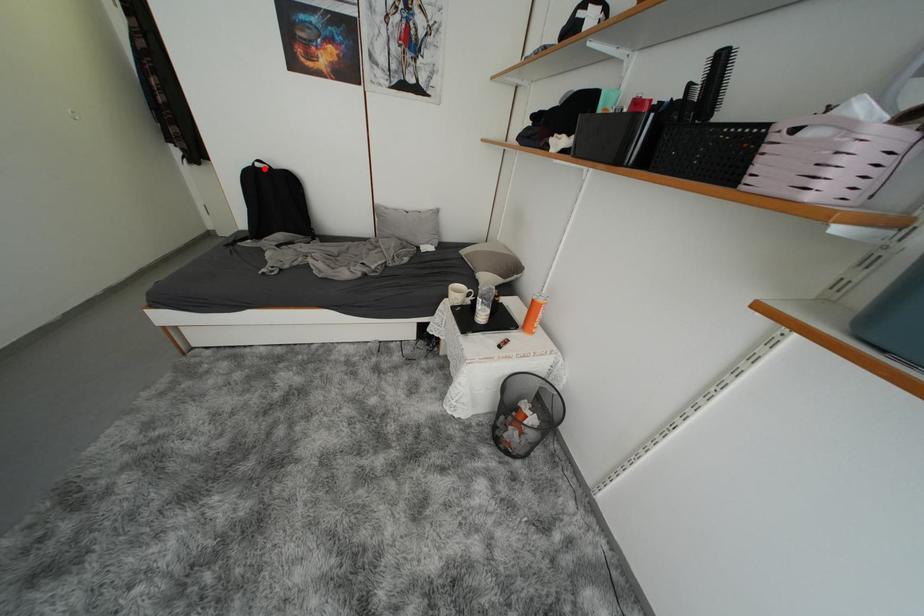
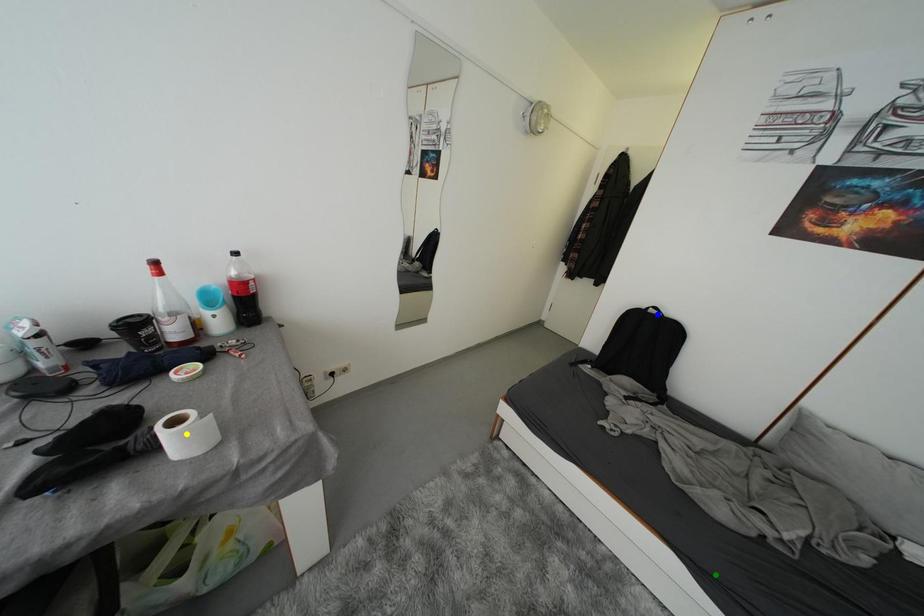
Question: I am providing you with two images of the same scene from different viewpoints. A red point is marked on the first image. You are given multiple points on the second image. Can you choose the point in image 2 that corresponds to the point in image 1?

Choices:
 (A) yellow point
 (B) green point
 (C) blue point

Answer: (C)